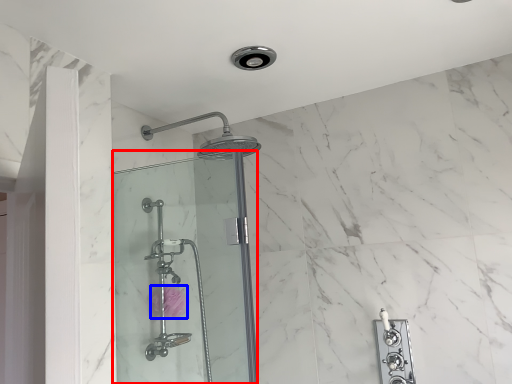
Question: Which object is closer to the camera taking this photo, shower door (highlighted by a red box) or flower (highlighted by a blue box)?

Choices:
 (A) shower door
 (B) flower

Answer: (A)